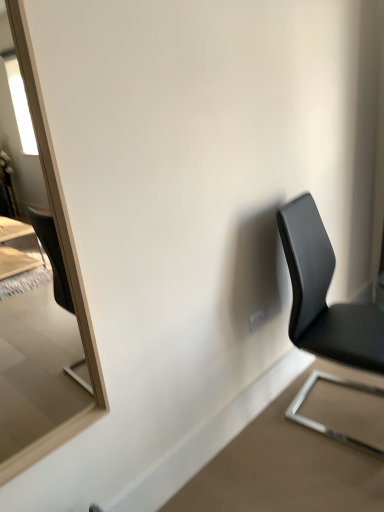
What is the approximate width of black leather chair at right?

20.08 inches.

The height and width of the screenshot is (512, 384). In order to click on black leather chair at right in this screenshot , I will do `click(324, 295)`.

Measure the distance between point (x=328, y=271) and camera.

Point (x=328, y=271) and camera are 6.61 feet apart from each other.

The image size is (384, 512). Describe the element at coordinates (324, 295) in the screenshot. I see `black leather chair at right` at that location.

This screenshot has height=512, width=384. I want to click on matte wooden mirror at left, so click(x=62, y=250).

Measure the distance between matte wooden mirror at left and camera.

matte wooden mirror at left is 38.05 inches away from camera.

Describe the element at coordinates (62, 250) in the screenshot. I see `matte wooden mirror at left` at that location.

Where is `black leather chair at right`? This screenshot has width=384, height=512. black leather chair at right is located at coordinates (324, 295).

Can you confirm if black leather chair at right is positioned to the left of matte wooden mirror at left?

Incorrect, black leather chair at right is not on the left side of matte wooden mirror at left.

Considering the relative positions of black leather chair at right and matte wooden mirror at left in the image provided, is black leather chair at right behind matte wooden mirror at left?

Yes, it is behind matte wooden mirror at left.

Which is closer to the camera, (312, 275) or (53, 441)?

The point (53, 441) is more forward.

From the image's perspective, is black leather chair at right located above matte wooden mirror at left?

Result: No, from the image's perspective, black leather chair at right is not over matte wooden mirror at left.

From a real-world perspective, between black leather chair at right and matte wooden mirror at left, who is vertically higher?

matte wooden mirror at left, from a real-world perspective.

Is black leather chair at right wider or thinner than matte wooden mirror at left?

Clearly, black leather chair at right has more width compared to matte wooden mirror at left.

Considering the relative sizes of black leather chair at right and matte wooden mirror at left in the image provided, is black leather chair at right shorter than matte wooden mirror at left?

Indeed, black leather chair at right has a lesser height compared to matte wooden mirror at left.

Consider the image. Does black leather chair at right have a smaller size compared to matte wooden mirror at left?

Incorrect, black leather chair at right is not smaller in size than matte wooden mirror at left.

Is black leather chair at right inside or outside of matte wooden mirror at left?

black leather chair at right cannot be found inside matte wooden mirror at left.

Are black leather chair at right and matte wooden mirror at left making contact?

No.

Does black leather chair at right turn towards matte wooden mirror at left?

No, black leather chair at right is not facing towards matte wooden mirror at left.

How many degrees apart are the facing directions of black leather chair at right and matte wooden mirror at left?

The facing directions of black leather chair at right and matte wooden mirror at left are 7.31 degrees apart.

How far apart are black leather chair at right and matte wooden mirror at left?

They are 3.38 feet apart.

Image resolution: width=384 pixels, height=512 pixels. In order to click on mirror above the black leather chair at right (from the image's perspective) in this screenshot , I will do `click(62, 250)`.

Is matte wooden mirror at left at the left side of black leather chair at right?

Correct, you'll find matte wooden mirror at left to the left of black leather chair at right.

Considering the positions of objects matte wooden mirror at left and black leather chair at right in the image provided, who is in front, matte wooden mirror at left or black leather chair at right?

Positioned in front is matte wooden mirror at left.

Is point (95, 351) closer to viewer compared to point (376, 310)?

Yes, point (95, 351) is closer to viewer.

From the image's perspective, is matte wooden mirror at left above or below black leather chair at right?

matte wooden mirror at left is situated higher than black leather chair at right in the image.

From a real-world perspective, is matte wooden mirror at left located higher than black leather chair at right?

Correct, in the physical world, matte wooden mirror at left is higher than black leather chair at right.

Considering the relative sizes of matte wooden mirror at left and black leather chair at right in the image provided, is matte wooden mirror at left thinner than black leather chair at right?

Yes.

Can you confirm if matte wooden mirror at left is shorter than black leather chair at right?

No.

Looking at this image, looking at the image, does matte wooden mirror at left seem bigger or smaller compared to black leather chair at right?

matte wooden mirror at left is smaller than black leather chair at right.

Is black leather chair at right completely or partially inside matte wooden mirror at left?

Answer: No.

Consider the image. Is matte wooden mirror at left with black leather chair at right?

There is a gap between matte wooden mirror at left and black leather chair at right.

Could you tell me if matte wooden mirror at left is facing black leather chair at right?

No, matte wooden mirror at left is not facing towards black leather chair at right.

How different are the orientations of matte wooden mirror at left and black leather chair at right in degrees?

The angle between the facing direction of matte wooden mirror at left and the facing direction of black leather chair at right is 7.31 degrees.

Identify the location of chair that appears below the matte wooden mirror at left (from a real-world perspective). The height and width of the screenshot is (512, 384). (324, 295).

Identify the location of mirror above the black leather chair at right (from a real-world perspective). This screenshot has width=384, height=512. (62, 250).

The width and height of the screenshot is (384, 512). I want to click on chair behind the matte wooden mirror at left, so click(324, 295).